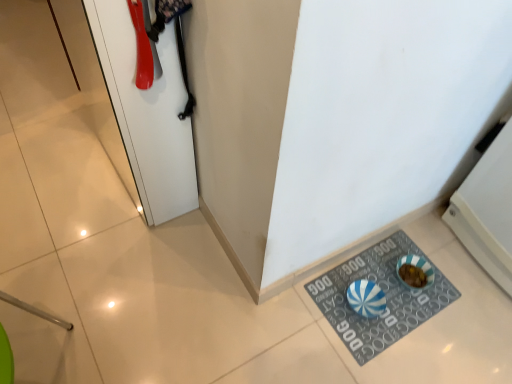
This screenshot has width=512, height=384. What do you see at coordinates (385, 294) in the screenshot?
I see `blue and white striped rubber mat at lower right` at bounding box center [385, 294].

The height and width of the screenshot is (384, 512). What are the coordinates of `blue and white striped rubber mat at lower right` in the screenshot? It's located at (385, 294).

Measure the distance between point (x=394, y=326) and camera.

They are 4.20 feet apart.

This screenshot has width=512, height=384. Identify the location of white glossy door at upper left. (147, 111).

Image resolution: width=512 pixels, height=384 pixels. What do you see at coordinates (147, 111) in the screenshot?
I see `white glossy door at upper left` at bounding box center [147, 111].

Identify the location of blue and white striped rubber mat at lower right. Image resolution: width=512 pixels, height=384 pixels. (385, 294).

Does blue and white striped rubber mat at lower right appear on the left side of white glossy door at upper left?

No.

Relative to white glossy door at upper left, is blue and white striped rubber mat at lower right in front or behind?

blue and white striped rubber mat at lower right is positioned farther from the viewer than white glossy door at upper left.

Is point (436, 284) closer to viewer compared to point (141, 17)?

No, it is not.

From the image's perspective, which one is positioned lower, blue and white striped rubber mat at lower right or white glossy door at upper left?

blue and white striped rubber mat at lower right is shown below in the image.

From a real-world perspective, which is physically below, blue and white striped rubber mat at lower right or white glossy door at upper left?

In real-world perspective, blue and white striped rubber mat at lower right is lower.

Looking at their sizes, would you say blue and white striped rubber mat at lower right is wider or thinner than white glossy door at upper left?

blue and white striped rubber mat at lower right is wider than white glossy door at upper left.

Considering the sizes of objects blue and white striped rubber mat at lower right and white glossy door at upper left in the image provided, who is taller, blue and white striped rubber mat at lower right or white glossy door at upper left?

With more height is white glossy door at upper left.

From the picture: Considering the relative sizes of blue and white striped rubber mat at lower right and white glossy door at upper left in the image provided, is blue and white striped rubber mat at lower right smaller than white glossy door at upper left?

Yes, blue and white striped rubber mat at lower right is smaller than white glossy door at upper left.

Could white glossy door at upper left be considered to be inside blue and white striped rubber mat at lower right?

That's incorrect, white glossy door at upper left is not inside blue and white striped rubber mat at lower right.

Is blue and white striped rubber mat at lower right not close to white glossy door at upper left?

No, blue and white striped rubber mat at lower right is in close proximity to white glossy door at upper left.

Is blue and white striped rubber mat at lower right looking in the opposite direction of white glossy door at upper left?

blue and white striped rubber mat at lower right does not have its back to white glossy door at upper left.

Based on the photo, measure the distance from blue and white striped rubber mat at lower right to white glossy door at upper left.

blue and white striped rubber mat at lower right is 26.47 inches from white glossy door at upper left.

Locate an element on the screen. door on the left side of blue and white striped rubber mat at lower right is located at coordinates (147, 111).

Is white glossy door at upper left to the right of blue and white striped rubber mat at lower right from the viewer's perspective?

No, white glossy door at upper left is not to the right of blue and white striped rubber mat at lower right.

Which object is more forward, white glossy door at upper left or blue and white striped rubber mat at lower right?

Positioned in front is white glossy door at upper left.

Is point (130, 63) farther from camera compared to point (398, 237)?

That is False.

From the image's perspective, does white glossy door at upper left appear lower than blue and white striped rubber mat at lower right?

Incorrect, from the image's perspective, white glossy door at upper left is higher than blue and white striped rubber mat at lower right.

Based on the photo, from a real-world perspective, between white glossy door at upper left and blue and white striped rubber mat at lower right, who is vertically higher?

white glossy door at upper left, from a real-world perspective.

In the scene shown: Considering the sizes of white glossy door at upper left and blue and white striped rubber mat at lower right in the image, is white glossy door at upper left wider or thinner than blue and white striped rubber mat at lower right?

Clearly, white glossy door at upper left has less width compared to blue and white striped rubber mat at lower right.

Consider the image. Considering the sizes of objects white glossy door at upper left and blue and white striped rubber mat at lower right in the image provided, who is shorter, white glossy door at upper left or blue and white striped rubber mat at lower right?

blue and white striped rubber mat at lower right is shorter.

Considering the sizes of objects white glossy door at upper left and blue and white striped rubber mat at lower right in the image provided, who is smaller, white glossy door at upper left or blue and white striped rubber mat at lower right?

Smaller between the two is blue and white striped rubber mat at lower right.

Would you say white glossy door at upper left is inside or outside blue and white striped rubber mat at lower right?

white glossy door at upper left is outside blue and white striped rubber mat at lower right.

Is white glossy door at upper left far away from blue and white striped rubber mat at lower right?

No, there isn't a large distance between white glossy door at upper left and blue and white striped rubber mat at lower right.

Is white glossy door at upper left facing towards blue and white striped rubber mat at lower right?

No, white glossy door at upper left is not turned towards blue and white striped rubber mat at lower right.

How distant is white glossy door at upper left from blue and white striped rubber mat at lower right?

They are 67.24 centimeters apart.

I want to click on door that is on the left side of blue and white striped rubber mat at lower right, so click(147, 111).

At what (x,y) coordinates should I click in order to perform the action: click on door above the blue and white striped rubber mat at lower right (from the image's perspective). Please return your answer as a coordinate pair (x, y). The height and width of the screenshot is (384, 512). Looking at the image, I should click on (147, 111).

Where is `doormat behind the white glossy door at upper left`? This screenshot has height=384, width=512. doormat behind the white glossy door at upper left is located at coordinates (385, 294).